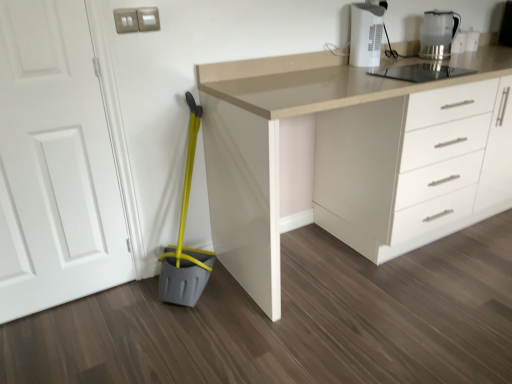
The image size is (512, 384). What are the coordinates of `white matte door at left` in the screenshot? It's located at (55, 163).

This screenshot has width=512, height=384. I want to click on white matte door at left, so click(55, 163).

Is beige laminate countertop at center facing towards white plastic coffee maker at upper right?

No.

From the image's perspective, who appears lower, beige laminate countertop at center or white plastic coffee maker at upper right?

From the image's view, beige laminate countertop at center is below.

Which is further, (x=246, y=101) or (x=367, y=58)?

Positioned behind is point (x=367, y=58).

Is point (429, 55) positioned in front of point (53, 304)?

That is False.

What's the angular difference between translucent glass kettle at upper right and white matte door at left's facing directions?

1.78 degrees.

Can you confirm if translucent glass kettle at upper right is bigger than white matte door at left?

No, translucent glass kettle at upper right is not bigger than white matte door at left.

Is translucent glass kettle at upper right oriented away from white matte door at left?

That's not correct — translucent glass kettle at upper right is not looking away from white matte door at left.

Between white plastic coffee maker at upper right and translucent glass kettle at upper right, which one has smaller size?

white plastic coffee maker at upper right.

Is white plastic coffee maker at upper right shorter than translucent glass kettle at upper right?

No, white plastic coffee maker at upper right is not shorter than translucent glass kettle at upper right.

This screenshot has height=384, width=512. What are the coordinates of `home appliance above the translucent glass kettle at upper right (from a real-world perspective)` in the screenshot? It's located at (366, 34).

Considering the positions of objects white plastic coffee maker at upper right and translucent glass kettle at upper right in the image provided, who is more to the left, white plastic coffee maker at upper right or translucent glass kettle at upper right?

white plastic coffee maker at upper right.

Could you tell me if white plastic coffee maker at upper right is facing beige laminate countertop at center?

No, white plastic coffee maker at upper right is not turned towards beige laminate countertop at center.

Locate an element on the screen. The height and width of the screenshot is (384, 512). countertop below the white plastic coffee maker at upper right (from the image's perspective) is located at coordinates (354, 156).

From the image's perspective, is white plastic coffee maker at upper right beneath beige laminate countertop at center?

Incorrect, from the image's perspective, white plastic coffee maker at upper right is higher than beige laminate countertop at center.

From a real-world perspective, is white plastic coffee maker at upper right physically located above or below beige laminate countertop at center?

In terms of real-world spatial position, white plastic coffee maker at upper right is above beige laminate countertop at center.

Looking at this image, can white plastic coffee maker at upper right be found inside translucent glass kettle at upper right?

Definitely not — white plastic coffee maker at upper right is not inside translucent glass kettle at upper right.

Consider the image. From the image's perspective, which object appears higher, translucent glass kettle at upper right or white plastic coffee maker at upper right?

translucent glass kettle at upper right is shown above in the image.

Considering the sizes of objects translucent glass kettle at upper right and white plastic coffee maker at upper right in the image provided, who is shorter, translucent glass kettle at upper right or white plastic coffee maker at upper right?

translucent glass kettle at upper right is shorter.

Could you tell me if translucent glass kettle at upper right is facing white plastic coffee maker at upper right?

No, translucent glass kettle at upper right is not turned towards white plastic coffee maker at upper right.

Can you tell me how much beige laminate countertop at center and white matte door at left differ in facing direction?

beige laminate countertop at center and white matte door at left are facing 1.78 degrees away from each other.

Which is nearer, (478, 200) or (63, 133)?

Clearly, point (478, 200) is more distant from the camera than point (63, 133).

Is beige laminate countertop at center bigger or smaller than white matte door at left?

Clearly, beige laminate countertop at center is larger in size than white matte door at left.

Between beige laminate countertop at center and white matte door at left, which one has less height?

beige laminate countertop at center is shorter.

Considering the sizes of objects white matte door at left and translucent glass kettle at upper right in the image provided, who is shorter, white matte door at left or translucent glass kettle at upper right?

translucent glass kettle at upper right is shorter.

Can you confirm if white matte door at left is positioned to the right of translucent glass kettle at upper right?

In fact, white matte door at left is to the left of translucent glass kettle at upper right.

From a real-world perspective, is white matte door at left below translucent glass kettle at upper right?

Yes, from a real-world perspective, white matte door at left is beneath translucent glass kettle at upper right.

Looking at this image, from the image's perspective, is white matte door at left under translucent glass kettle at upper right?

Yes.

At what (x,y) coordinates should I click in order to perform the action: click on home appliance located above the beige laminate countertop at center (from the image's perspective). Please return your answer as a coordinate pair (x, y). The height and width of the screenshot is (384, 512). Looking at the image, I should click on (366, 34).

This screenshot has height=384, width=512. What are the coordinates of `kitchen appliance above the white matte door at left (from a real-world perspective)` in the screenshot? It's located at (438, 34).

In the scene shown: Considering their positions, is white matte door at left positioned further to beige laminate countertop at center than translucent glass kettle at upper right?

Based on the image, white matte door at left appears to be further to beige laminate countertop at center.

When comparing their distances from white plastic coffee maker at upper right, does translucent glass kettle at upper right or beige laminate countertop at center seem further?

Among the two, beige laminate countertop at center is located further to white plastic coffee maker at upper right.

Considering their positions, is translucent glass kettle at upper right positioned further to beige laminate countertop at center than white plastic coffee maker at upper right?

The object further to beige laminate countertop at center is translucent glass kettle at upper right.

In the scene shown: Based on their spatial positions, is beige laminate countertop at center or white plastic coffee maker at upper right further from white matte door at left?

Based on the image, white plastic coffee maker at upper right appears to be further to white matte door at left.

Estimate the real-world distances between objects in this image. Which object is closer to beige laminate countertop at center, white plastic coffee maker at upper right or white matte door at left?

Among the two, white plastic coffee maker at upper right is located nearer to beige laminate countertop at center.

Based on their spatial positions, is beige laminate countertop at center or translucent glass kettle at upper right further from white matte door at left?

translucent glass kettle at upper right.

When comparing their distances from beige laminate countertop at center, does white matte door at left or white plastic coffee maker at upper right seem further?

white matte door at left is positioned further to the anchor beige laminate countertop at center.

Based on their spatial positions, is white matte door at left or white plastic coffee maker at upper right further from translucent glass kettle at upper right?

white matte door at left.

You are a GUI agent. You are given a task and a screenshot of the screen. Output one action in this format:
    pyautogui.click(x=<x>, y=<y>)
    Task: Click on the kitchen appliance between white matte door at left and beige laminate countertop at center in the horizontal direction
    This screenshot has width=512, height=384.
    Given the screenshot: What is the action you would take?
    pyautogui.click(x=438, y=34)

This screenshot has width=512, height=384. What are the coordinates of `home appliance positioned between beige laminate countertop at center and translucent glass kettle at upper right from near to far` in the screenshot? It's located at (366, 34).

Find the location of a particular element. home appliance between white matte door at left and beige laminate countertop at center is located at coordinates (366, 34).

Locate an element on the screen. Image resolution: width=512 pixels, height=384 pixels. home appliance between white matte door at left and translucent glass kettle at upper right is located at coordinates (366, 34).